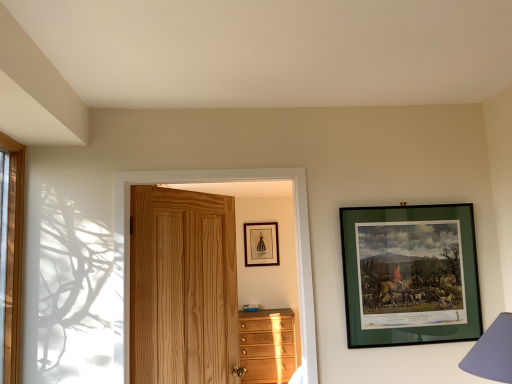
What is the approximate width of purple fabric lampshade at lower right?

12.84 inches.

Describe the element at coordinates (261, 244) in the screenshot. I see `matte black picture frame at upper center, the second picture frame when ordered from front to back` at that location.

Where is `light brown wooden chest of drawers at lower center`? This screenshot has height=384, width=512. light brown wooden chest of drawers at lower center is located at coordinates (267, 346).

What are the coordinates of `the 2nd picture frame above the light brown wooden chest of drawers at lower center (from a real-world perspective)` in the screenshot? It's located at (261, 244).

Is light brown wooden chest of drawers at lower center shorter than matte black picture frame at upper center, the first picture frame positioned from the left?

No, light brown wooden chest of drawers at lower center is not shorter than matte black picture frame at upper center, the first picture frame positioned from the left.

Which is more to the left, light brown wooden chest of drawers at lower center or matte black picture frame at upper center, arranged as the second picture frame when viewed from the right?

Positioned to the left is matte black picture frame at upper center, arranged as the second picture frame when viewed from the right.

From the image's perspective, which one is positioned higher, light brown wooden chest of drawers at lower center or matte black picture frame at upper center, the first picture frame positioned from the left?

matte black picture frame at upper center, the first picture frame positioned from the left, from the image's perspective.

Can you tell me how much green matte picture frame at upper right, which is counted as the first picture frame, starting from the front, and light brown wooden chest of drawers at lower center differ in facing direction?

They differ by 4.18 degrees in their facing directions.

Considering the sizes of green matte picture frame at upper right, which is counted as the first picture frame, starting from the front, and light brown wooden chest of drawers at lower center in the image, is green matte picture frame at upper right, which is counted as the first picture frame, starting from the front, wider or thinner than light brown wooden chest of drawers at lower center?

green matte picture frame at upper right, which is counted as the first picture frame, starting from the front, is thinner than light brown wooden chest of drawers at lower center.

From a real-world perspective, between green matte picture frame at upper right, the second picture frame from the left, and light brown wooden chest of drawers at lower center, who is vertically higher?

green matte picture frame at upper right, the second picture frame from the left, from a real-world perspective.

Is point (468, 266) farther from camera compared to point (267, 369)?

No, (468, 266) is in front of (267, 369).

From a real-world perspective, between matte black picture frame at upper center, arranged as the second picture frame when viewed from the right, and green matte picture frame at upper right, the second picture frame from the left, who is vertically higher?

matte black picture frame at upper center, arranged as the second picture frame when viewed from the right, from a real-world perspective.

Considering the relative sizes of matte black picture frame at upper center, the first picture frame positioned from the left, and green matte picture frame at upper right, marked as the second picture frame in a back-to-front arrangement, in the image provided, is matte black picture frame at upper center, the first picture frame positioned from the left, smaller than green matte picture frame at upper right, marked as the second picture frame in a back-to-front arrangement,?

Yes.

Is matte black picture frame at upper center, the 1th picture frame when ordered from back to front, taller or shorter than green matte picture frame at upper right, the 1th picture frame when ordered from right to left?

Considering their sizes, matte black picture frame at upper center, the 1th picture frame when ordered from back to front, has less height than green matte picture frame at upper right, the 1th picture frame when ordered from right to left.

Between matte black picture frame at upper center, the first picture frame positioned from the left, and green matte picture frame at upper right, the second picture frame from the left, which one appears on the left side from the viewer's perspective?

matte black picture frame at upper center, the first picture frame positioned from the left, is more to the left.

Would you say purple fabric lampshade at lower right is to the left or to the right of matte black picture frame at upper center, arranged as the second picture frame when viewed from the right, in the picture?

Based on their positions, purple fabric lampshade at lower right is located to the right of matte black picture frame at upper center, arranged as the second picture frame when viewed from the right.

From the image's perspective, relative to matte black picture frame at upper center, the first picture frame positioned from the left, is purple fabric lampshade at lower right above or below?

purple fabric lampshade at lower right is situated higher than matte black picture frame at upper center, the first picture frame positioned from the left, in the image.

In terms of size, does purple fabric lampshade at lower right appear bigger or smaller than matte black picture frame at upper center, the second picture frame when ordered from front to back?

Considering their sizes, purple fabric lampshade at lower right takes up more space than matte black picture frame at upper center, the second picture frame when ordered from front to back.

Is purple fabric lampshade at lower right turned away from matte black picture frame at upper center, the first picture frame positioned from the left?

That's not correct — purple fabric lampshade at lower right is not looking away from matte black picture frame at upper center, the first picture frame positioned from the left.

Is purple fabric lampshade at lower right directly adjacent to natural wood door at center?

No, purple fabric lampshade at lower right is not beside natural wood door at center.

Considering the relative sizes of purple fabric lampshade at lower right and natural wood door at center in the image provided, is purple fabric lampshade at lower right taller than natural wood door at center?

No.

Is purple fabric lampshade at lower right positioned behind natural wood door at center?

No, purple fabric lampshade at lower right is closer to the camera.

Identify the location of door behind the purple fabric lampshade at lower right. This screenshot has height=384, width=512. (222, 182).

Looking at this image, considering the sizes of objects light brown wooden chest of drawers at lower center and green matte picture frame at upper right, marked as the second picture frame in a back-to-front arrangement, in the image provided, who is thinner, light brown wooden chest of drawers at lower center or green matte picture frame at upper right, marked as the second picture frame in a back-to-front arrangement,?

With smaller width is green matte picture frame at upper right, marked as the second picture frame in a back-to-front arrangement.

Considering the relative positions of light brown wooden chest of drawers at lower center and green matte picture frame at upper right, the second picture frame from the left, in the image provided, is light brown wooden chest of drawers at lower center to the left or to the right of green matte picture frame at upper right, the second picture frame from the left,?

From the image, it's evident that light brown wooden chest of drawers at lower center is to the left of green matte picture frame at upper right, the second picture frame from the left.

From the picture: Is light brown wooden chest of drawers at lower center placed right next to green matte picture frame at upper right, the second picture frame from the left?

No, light brown wooden chest of drawers at lower center is not with green matte picture frame at upper right, the second picture frame from the left.

Does light brown wooden chest of drawers at lower center have a smaller size compared to green matte picture frame at upper right, which is counted as the first picture frame, starting from the front?

No, light brown wooden chest of drawers at lower center is not smaller than green matte picture frame at upper right, which is counted as the first picture frame, starting from the front.

Is matte black picture frame at upper center, the 1th picture frame when ordered from back to front, turned away from purple fabric lampshade at lower right?

No, matte black picture frame at upper center, the 1th picture frame when ordered from back to front,'s orientation is not away from purple fabric lampshade at lower right.

The height and width of the screenshot is (384, 512). In the image, there is a matte black picture frame at upper center, arranged as the second picture frame when viewed from the right. Identify the location of table lamp above it (from the image's perspective). (492, 352).

Can you confirm if matte black picture frame at upper center, the 1th picture frame when ordered from back to front, is positioned to the right of purple fabric lampshade at lower right?

No, matte black picture frame at upper center, the 1th picture frame when ordered from back to front, is not to the right of purple fabric lampshade at lower right.

Considering the sizes of matte black picture frame at upper center, arranged as the second picture frame when viewed from the right, and purple fabric lampshade at lower right in the image, is matte black picture frame at upper center, arranged as the second picture frame when viewed from the right, taller or shorter than purple fabric lampshade at lower right?

In the image, matte black picture frame at upper center, arranged as the second picture frame when viewed from the right, appears to be taller than purple fabric lampshade at lower right.

The image size is (512, 384). Find the location of `the chest of drawers that is below the matte black picture frame at upper center, the second picture frame when ordered from front to back (from the image's perspective)`. the chest of drawers that is below the matte black picture frame at upper center, the second picture frame when ordered from front to back (from the image's perspective) is located at coordinates (267, 346).

Find the location of `the chest of drawers that is behind the green matte picture frame at upper right, marked as the second picture frame in a back-to-front arrangement`. the chest of drawers that is behind the green matte picture frame at upper right, marked as the second picture frame in a back-to-front arrangement is located at coordinates (267, 346).

When comparing their distances from purple fabric lampshade at lower right, does natural wood door at center or matte black picture frame at upper center, the first picture frame positioned from the left, seem closer?

natural wood door at center is positioned closer to the anchor purple fabric lampshade at lower right.

Based on their spatial positions, is purple fabric lampshade at lower right or natural wood door at center further from light brown wooden chest of drawers at lower center?

Among the two, purple fabric lampshade at lower right is located further to light brown wooden chest of drawers at lower center.

Estimate the real-world distances between objects in this image. Which object is further from matte black picture frame at upper center, the second picture frame when ordered from front to back, purple fabric lampshade at lower right or natural wood door at center?

Based on the image, purple fabric lampshade at lower right appears to be further to matte black picture frame at upper center, the second picture frame when ordered from front to back.

Considering their positions, is green matte picture frame at upper right, which is counted as the first picture frame, starting from the front, positioned closer to matte black picture frame at upper center, the first picture frame positioned from the left, than light brown wooden chest of drawers at lower center?

Based on the image, light brown wooden chest of drawers at lower center appears to be nearer to matte black picture frame at upper center, the first picture frame positioned from the left.

Which object lies further to the anchor point natural wood door at center, matte black picture frame at upper center, the 1th picture frame when ordered from back to front, or light brown wooden chest of drawers at lower center?

The object further to natural wood door at center is matte black picture frame at upper center, the 1th picture frame when ordered from back to front.

Estimate the real-world distances between objects in this image. Which object is closer to purple fabric lampshade at lower right, green matte picture frame at upper right, marked as the second picture frame in a back-to-front arrangement, or matte black picture frame at upper center, the 1th picture frame when ordered from back to front?

green matte picture frame at upper right, marked as the second picture frame in a back-to-front arrangement, is closer to purple fabric lampshade at lower right.

When comparing their distances from green matte picture frame at upper right, the 1th picture frame when ordered from right to left, does light brown wooden chest of drawers at lower center or natural wood door at center seem closer?

Based on the image, natural wood door at center appears to be nearer to green matte picture frame at upper right, the 1th picture frame when ordered from right to left.

Estimate the real-world distances between objects in this image. Which object is closer to natural wood door at center, green matte picture frame at upper right, which is counted as the first picture frame, starting from the front, or matte black picture frame at upper center, the first picture frame positioned from the left?

Based on the image, green matte picture frame at upper right, which is counted as the first picture frame, starting from the front, appears to be nearer to natural wood door at center.

I want to click on picture frame located between natural wood door at center and matte black picture frame at upper center, the 1th picture frame when ordered from back to front, in the depth direction, so click(x=410, y=274).

Locate an element on the screen. Image resolution: width=512 pixels, height=384 pixels. door located between purple fabric lampshade at lower right and light brown wooden chest of drawers at lower center in the depth direction is located at coordinates (222, 182).

Find the location of a particular element. The height and width of the screenshot is (384, 512). picture frame positioned between purple fabric lampshade at lower right and light brown wooden chest of drawers at lower center from near to far is located at coordinates (410, 274).

At what (x,y) coordinates should I click in order to perform the action: click on chest of drawers between purple fabric lampshade at lower right and matte black picture frame at upper center, the second picture frame when ordered from front to back, in the front-back direction. Please return your answer as a coordinate pair (x, y). Looking at the image, I should click on (267, 346).